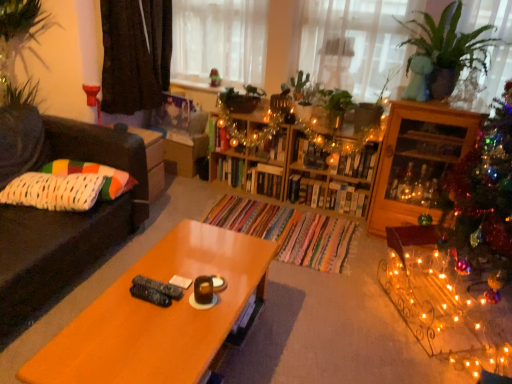
Question: Is wooden bookshelf at center oriented away from green leafy plant at center?

Choices:
 (A) yes
 (B) no

Answer: (B)

Question: Is wooden bookshelf at center positioned far away from green leafy plant at center?

Choices:
 (A) no
 (B) yes

Answer: (A)

Question: Considering the relative sizes of wooden bookshelf at center and green leafy plant at center in the image provided, is wooden bookshelf at center taller than green leafy plant at center?

Choices:
 (A) no
 (B) yes

Answer: (B)

Question: Is the position of wooden bookshelf at center less distant than that of green leafy plant at center?

Choices:
 (A) yes
 (B) no

Answer: (B)

Question: Does wooden bookshelf at center have a lesser width compared to green leafy plant at center?

Choices:
 (A) no
 (B) yes

Answer: (B)

Question: In terms of size, does wooden bookshelf at center, which is the 2th shelf from left to right, appear bigger or smaller than wooden bookshelf at center, arranged as the first shelf when viewed from the left?

Choices:
 (A) big
 (B) small

Answer: (A)

Question: Do you think wooden bookshelf at center, positioned as the first shelf in right-to-left order, is within wooden bookshelf at center, placed as the 2th shelf when sorted from right to left, or outside of it?

Choices:
 (A) outside
 (B) inside

Answer: (A)

Question: From the image's perspective, is wooden bookshelf at center, which is the 2th shelf from left to right, located above or below wooden bookshelf at center, arranged as the first shelf when viewed from the left?

Choices:
 (A) above
 (B) below

Answer: (B)

Question: Considering the positions of wooden bookshelf at center, positioned as the first shelf in right-to-left order, and wooden bookshelf at center, placed as the 2th shelf when sorted from right to left, in the image, is wooden bookshelf at center, positioned as the first shelf in right-to-left order, wider or thinner than wooden bookshelf at center, placed as the 2th shelf when sorted from right to left,?

Choices:
 (A) thin
 (B) wide

Answer: (B)

Question: Looking at the image, does dark brown fabric at upper left seem bigger or smaller compared to translucent fabric at upper center?

Choices:
 (A) small
 (B) big

Answer: (B)

Question: Is dark brown fabric at upper left in front of or behind translucent fabric at upper center in the image?

Choices:
 (A) front
 (B) behind

Answer: (A)

Question: Considering the positions of point (125, 76) and point (219, 21), is point (125, 76) closer or farther from the camera than point (219, 21)?

Choices:
 (A) farther
 (B) closer

Answer: (B)

Question: From a real-world perspective, relative to translucent fabric at upper center, is dark brown fabric at upper left vertically above or below?

Choices:
 (A) below
 (B) above

Answer: (A)

Question: In the image, is green leafy plant at center on the left side or the right side of white knitted pillow at left, which is the 1th pillow in front-to-back order?

Choices:
 (A) left
 (B) right

Answer: (B)

Question: Considering the positions of green leafy plant at center and white knitted pillow at left, which is the 1th pillow in front-to-back order, in the image, is green leafy plant at center wider or thinner than white knitted pillow at left, which is the 1th pillow in front-to-back order,?

Choices:
 (A) wide
 (B) thin

Answer: (A)